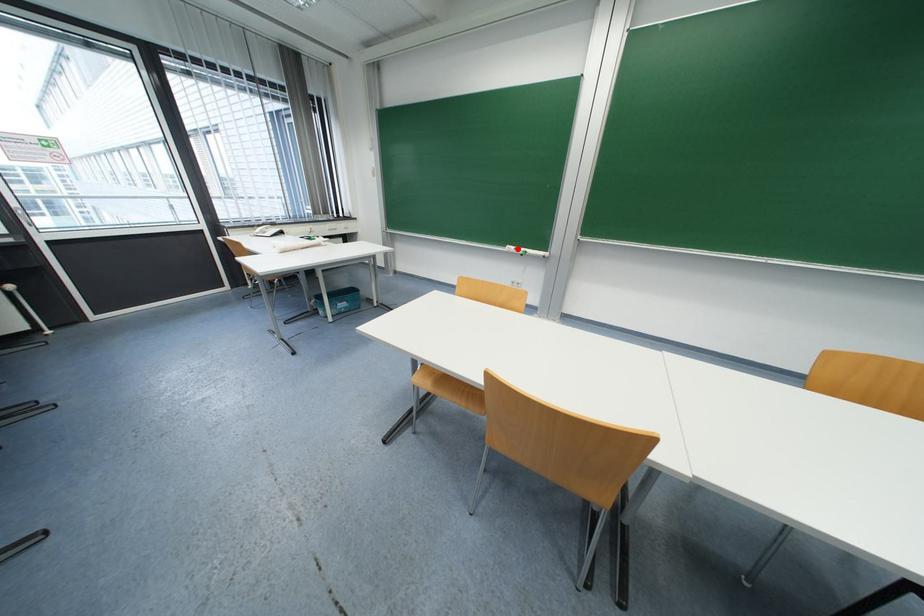
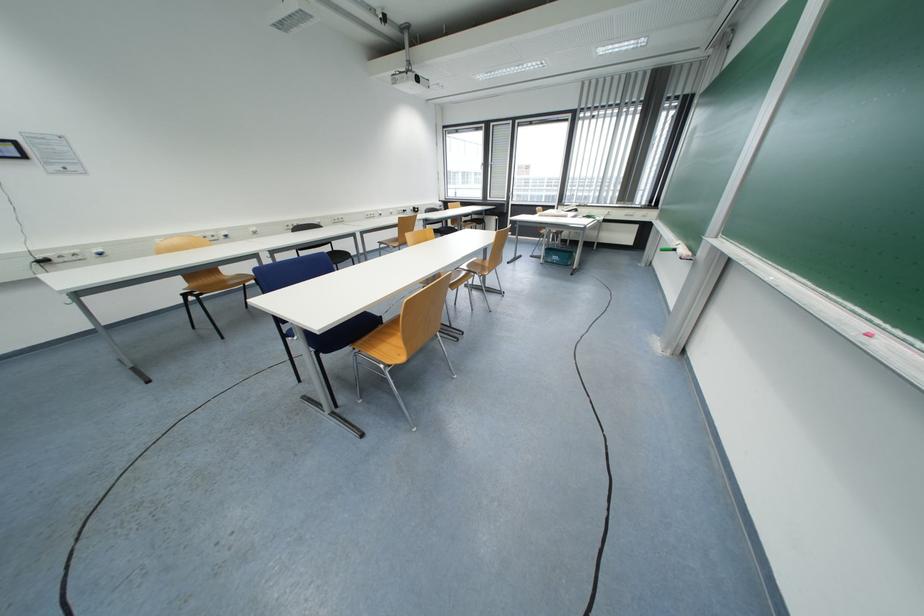
Locate, in the second image, the point that corresponds to the highlighted location in the first image.

(683, 244)